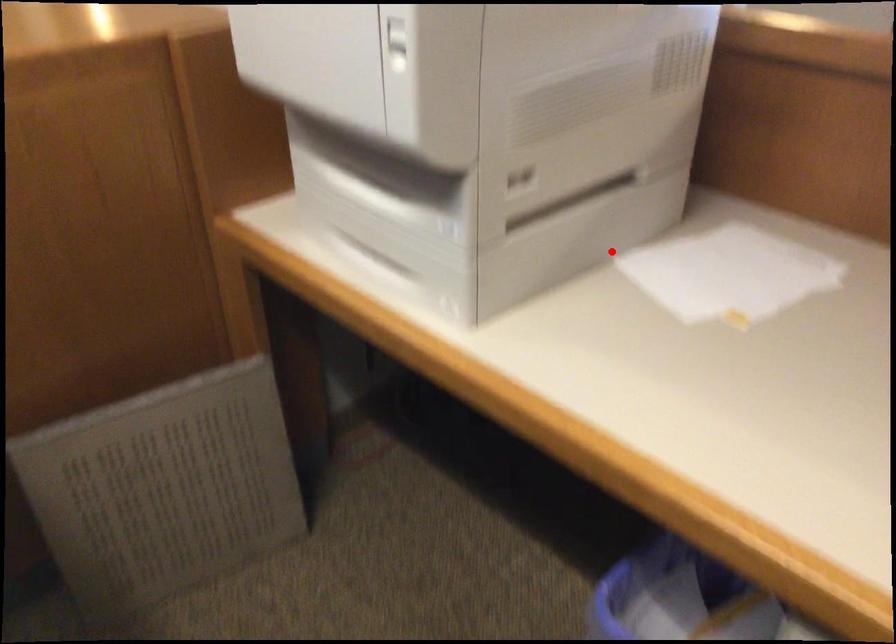
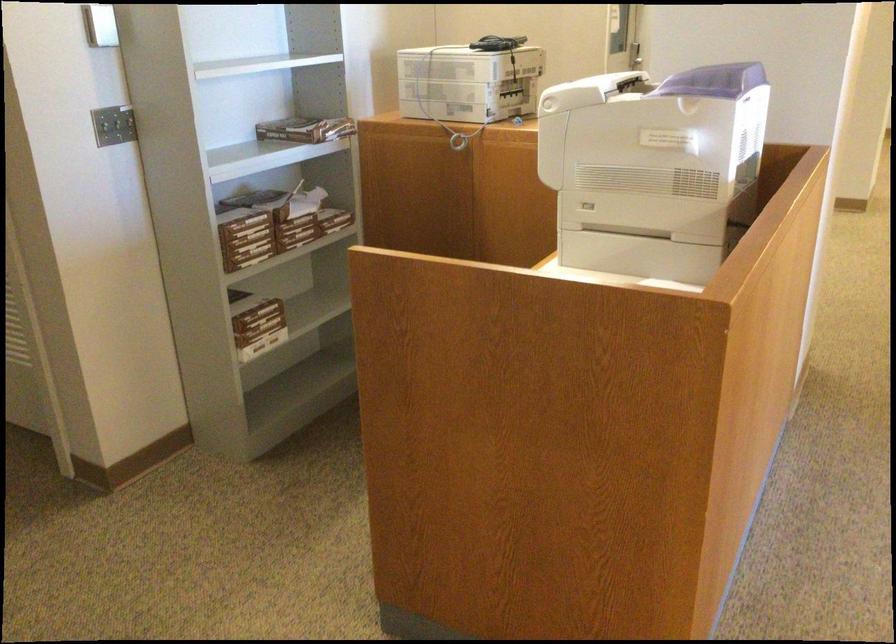
Locate, in the second image, the point that corresponds to the highlighted location in the first image.

(640, 254)